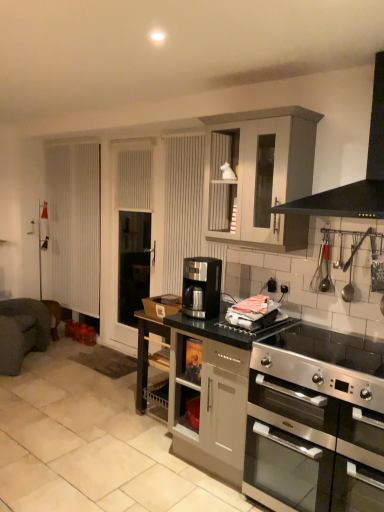
Question: Would you say matte gray cabinet at center, which is counted as the 1th cabinetry, starting from the bottom, is inside or outside stainless steel oven at lower right?

Choices:
 (A) inside
 (B) outside

Answer: (B)

Question: From the image's perspective, is matte gray cabinet at center, which ranks as the second cabinetry in top-to-bottom order, located above or below stainless steel oven at lower right?

Choices:
 (A) above
 (B) below

Answer: (A)

Question: Which object is the farthest from the dark gray fabric armchair at left?

Choices:
 (A) satin black coffee machine at center
 (B) white matte cabinet at upper center, which appears as the first cabinetry when viewed from the top
 (C) white vertical blinds at left
 (D) stainless steel oven at lower right
 (E) stainless steel gas stove at lower right

Answer: (E)

Question: Which object is the farthest from the satin black coffee machine at center?

Choices:
 (A) stainless steel oven at lower right
 (B) matte black countertop at center
 (C) stainless steel gas stove at lower right
 (D) white vertical blinds at left
 (E) dark gray fabric armchair at left

Answer: (D)